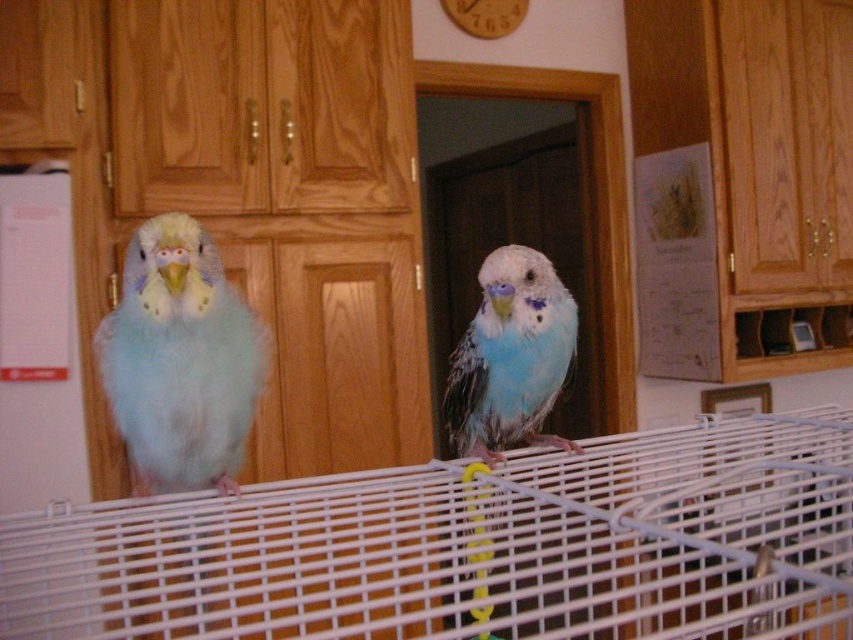
Question: Which point is closer to the camera?

Choices:
 (A) 670,593
 (B) 486,298

Answer: (B)

Question: Does white wire cage at center lie behind light blue feathered parrot at center?

Choices:
 (A) yes
 (B) no

Answer: (B)

Question: Which point is farther from the camera taking this photo?

Choices:
 (A) 236,392
 (B) 582,499
 (C) 471,332

Answer: (C)

Question: Which object is the farthest from the white wire cage at center?

Choices:
 (A) light blue feathered parrot at center
 (B) light blue feathered parrot at left

Answer: (B)

Question: Can you confirm if white wire cage at center is thinner than light blue feathered parrot at left?

Choices:
 (A) no
 (B) yes

Answer: (A)

Question: Is white wire cage at center further to the viewer compared to light blue feathered parrot at left?

Choices:
 (A) no
 (B) yes

Answer: (A)